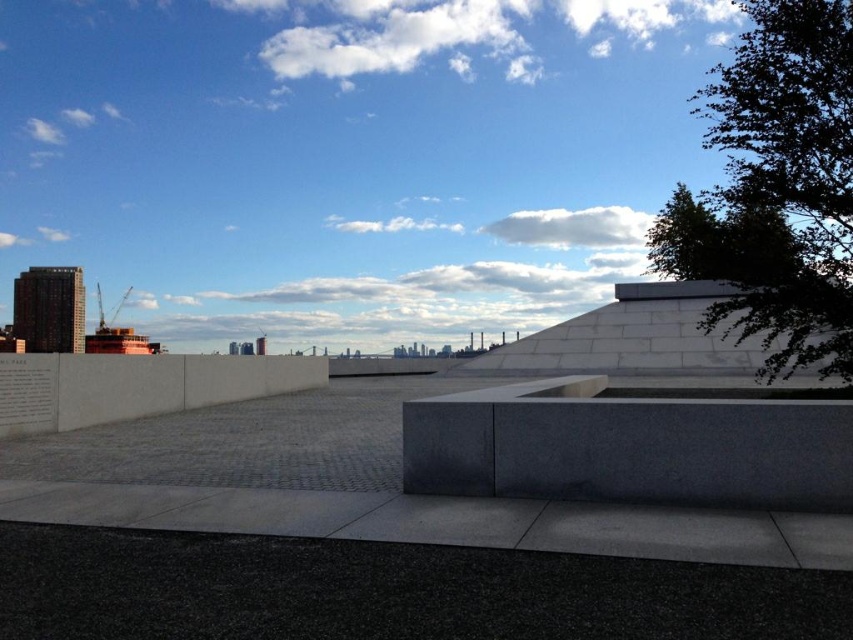
You are standing in the plaza and want to take a photo of the gray granite ledge at center without the green leafy tree at upper right blocking the view. Which direction should you move to achieve this?

You should move away from the green leafy tree at upper right so that the gray granite ledge at center comes into focus, as the tree is closer to you and blocking the view.

You are a maintenance worker needing to move a 10 meter long equipment from the gray granite ledge at center to the white concrete ledge at center. Can you move it without bending or shortening the equipment?

The gray granite ledge at center is 9.42 meters from the white concrete ledge at center. Since the equipment is 10 meters long, it is longer than the distance between them, so you cannot move it without bending or shortening the equipment.